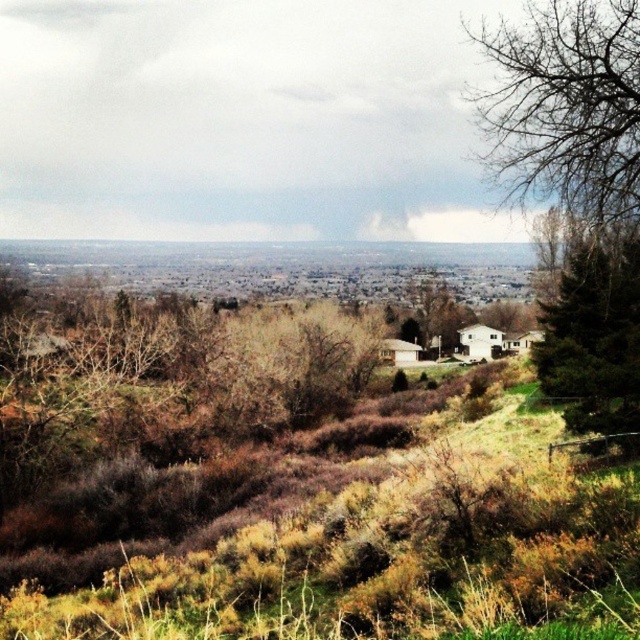
Between brown dry grass at lower center and green textured pine tree at right, which one is positioned lower?

brown dry grass at lower center is lower down.

Which of these two, brown dry grass at lower center or green textured pine tree at right, stands shorter?

Standing shorter between the two is brown dry grass at lower center.

Who is more forward, (371, 557) or (616, 282)?

Point (371, 557)

In order to click on brown dry grass at lower center in this screenshot , I will do `click(376, 561)`.